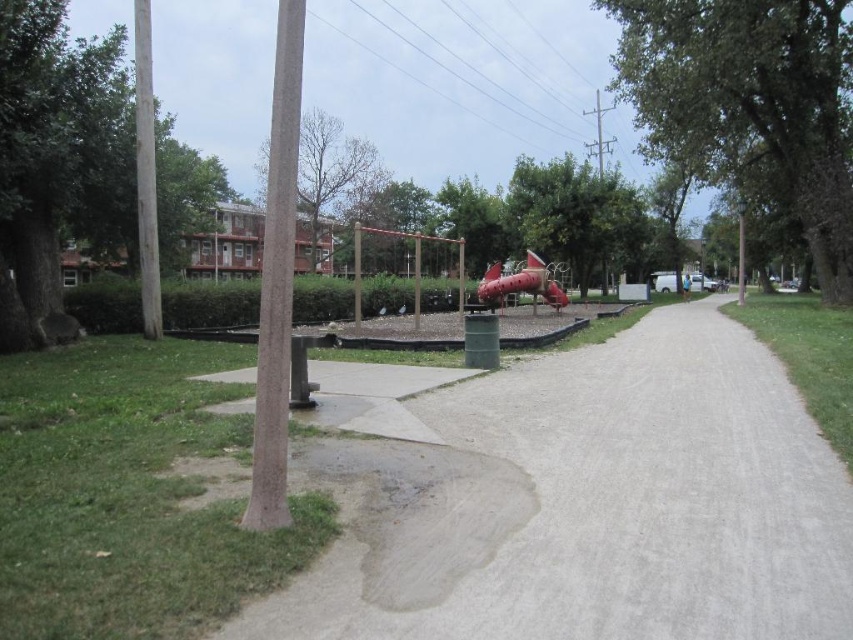
Question: Based on their relative distances, which object is farther from the green leafy tree at center?

Choices:
 (A) brown textured pole at left
 (B) metallic red slide at center
 (C) smooth concrete path at center

Answer: (C)

Question: Which point is farther to the camera?

Choices:
 (A) brown rough textured pole at left
 (B) green rough bark tree at left
 (C) metallic red slide at center

Answer: (C)

Question: Does green rough bark tree at left appear under green leafy tree at center?

Choices:
 (A) yes
 (B) no

Answer: (B)

Question: Is brown rough textured pole at left closer to camera compared to smooth red slide at center?

Choices:
 (A) no
 (B) yes

Answer: (B)

Question: Can you confirm if green leafy tree at right is thinner than green rough bark tree at left?

Choices:
 (A) no
 (B) yes

Answer: (B)

Question: Considering the real-world distances, which object is farthest from the green leafy tree at center?

Choices:
 (A) green leafy tree at right
 (B) metallic red slide at center
 (C) brown rough textured pole at left

Answer: (C)